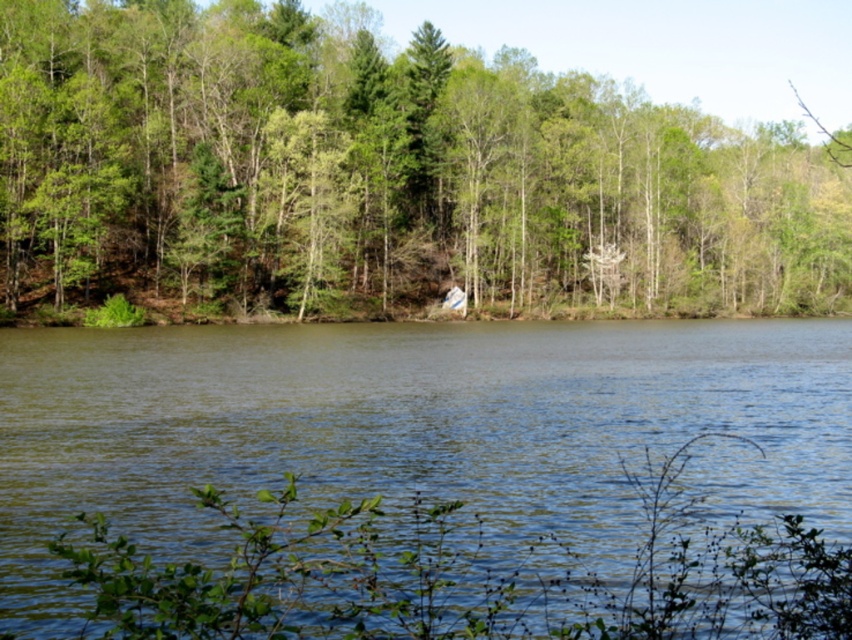
Image resolution: width=852 pixels, height=640 pixels. In order to click on green leafy tree at center in this screenshot , I will do `click(380, 173)`.

Does green leafy tree at center lie in front of greenish water at center?

No.

Who is more distant from viewer, (691, 256) or (325, 353)?

Point (691, 256)

Identify the location of green leafy tree at center. The image size is (852, 640). (380, 173).